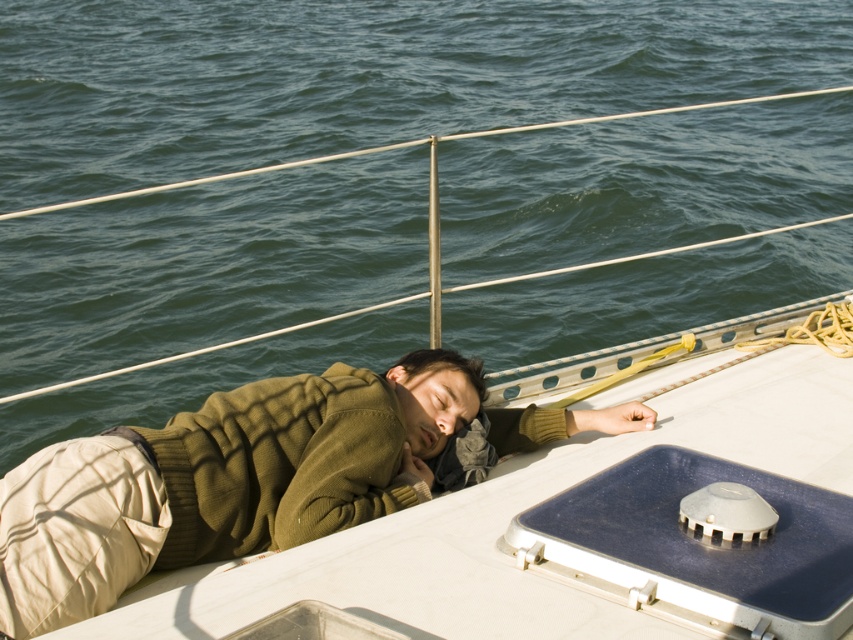
You are a sailor on the boat and want to place a 1.5 meter long fishing rod between the green water at center and the green knitted sweater at center. Is there enough space for the fishing rod to fit horizontally between them?

The distance between the green water at center and the green knitted sweater at center is 7.42 meters, which is greater than the 1.5 meter length of the fishing rod. Therefore, there is enough space to place the fishing rod horizontally between them.

You are navigating a drone over the deck of a boat. Your mission is to drop a lifebuoy at the point marked as point (360,76). According to the image, where should you drop the lifebuoy?

The point (360,76) is on green water at center, so you should drop the lifebuoy on the green water at center.

You are a sailor on the boat and want to place a small item on the deck near the green knitted sweater at center without it falling into the green water at center. Where should you place it?

The green water at center is positioned over green knitted sweater at center, so you should place the item on the deck below the green knitted sweater at center to prevent it from falling into the green water at center.